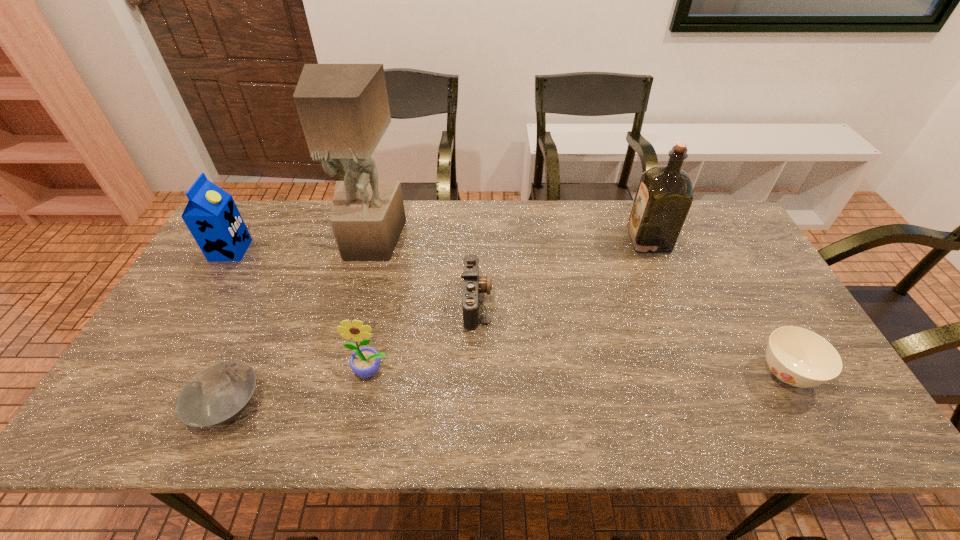
Locate an element on the screen. The image size is (960, 540). the tallest object is located at coordinates (344, 111).

Find the location of a particular element. the sixth object from left to right is located at coordinates (664, 196).

What are the coordinates of `the second tallest object` in the screenshot? It's located at (664, 196).

Image resolution: width=960 pixels, height=540 pixels. What are the coordinates of `the third tallest object` in the screenshot? It's located at (211, 215).

Identify the location of carton. This screenshot has height=540, width=960. (211, 215).

Find the location of a particular element. This screenshot has height=540, width=960. sunflower is located at coordinates (364, 362).

Identify the location of the third object from right to left. The image size is (960, 540). (473, 284).

Find the location of a particular element. camera is located at coordinates (473, 284).

Find the location of a particular element. the rightmost object is located at coordinates (x=799, y=357).

Where is `the shortest object`? The image size is (960, 540). the shortest object is located at coordinates (219, 393).